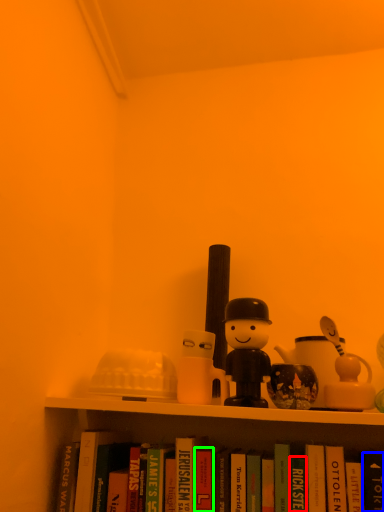
Question: Considering the real-world distances, which object is farthest from paperback book (highlighted by a red box)? paperback book (highlighted by a blue box) or paperback book (highlighted by a green box)?

Choices:
 (A) paperback book
 (B) paperback book

Answer: (B)